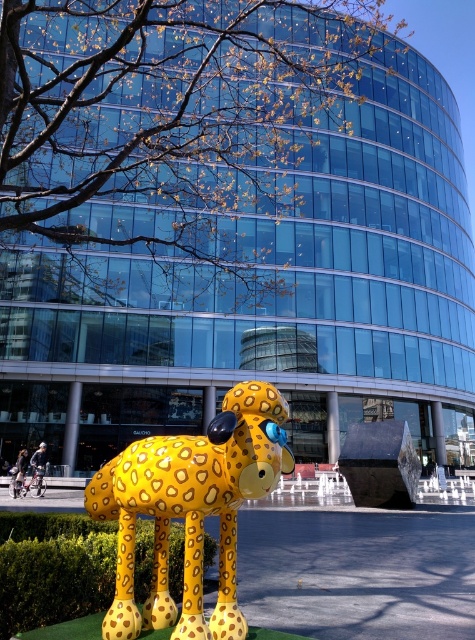
Question: Which object appears farthest from the camera in this image?

Choices:
 (A) yellow spotted dog at center
 (B) green hedge at lower left

Answer: (B)

Question: Which of the following is the farthest from the observer?

Choices:
 (A) (172, 452)
 (B) (75, 593)

Answer: (B)

Question: Where is yellow spotted dog at center located in relation to green hedge at lower left in the image?

Choices:
 (A) below
 (B) above

Answer: (B)

Question: Which of the following is the farthest from the observer?

Choices:
 (A) (214, 620)
 (B) (107, 563)

Answer: (B)

Question: From the image, what is the correct spatial relationship of yellow spotted dog at center in relation to green hedge at lower left?

Choices:
 (A) right
 (B) left

Answer: (A)

Question: Can you confirm if yellow spotted dog at center is bigger than green hedge at lower left?

Choices:
 (A) yes
 (B) no

Answer: (B)